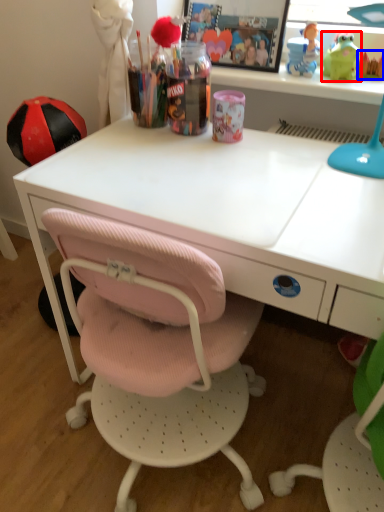
Question: Among these objects, which one is nearest to the camera, toy (highlighted by a red box) or toy (highlighted by a blue box)?

Choices:
 (A) toy
 (B) toy

Answer: (A)